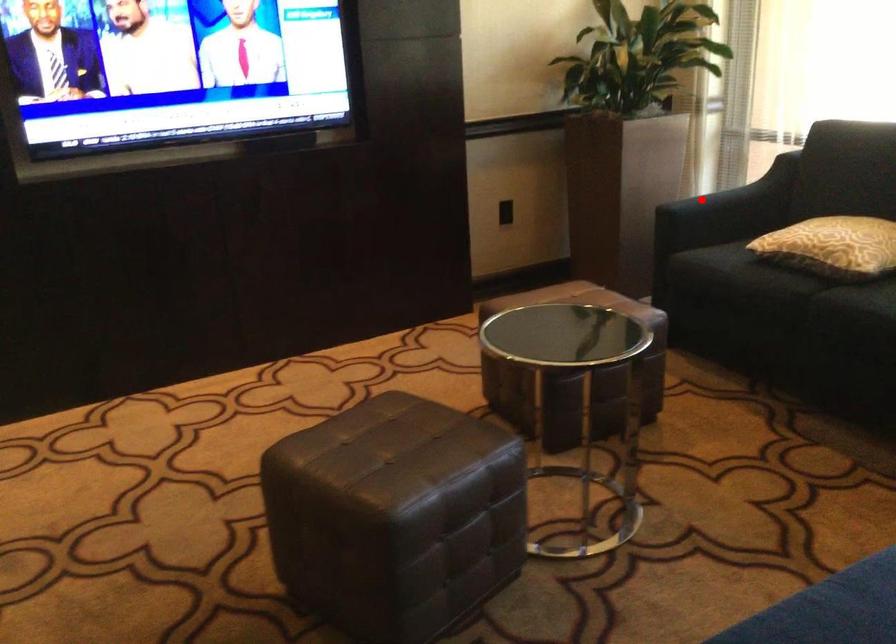
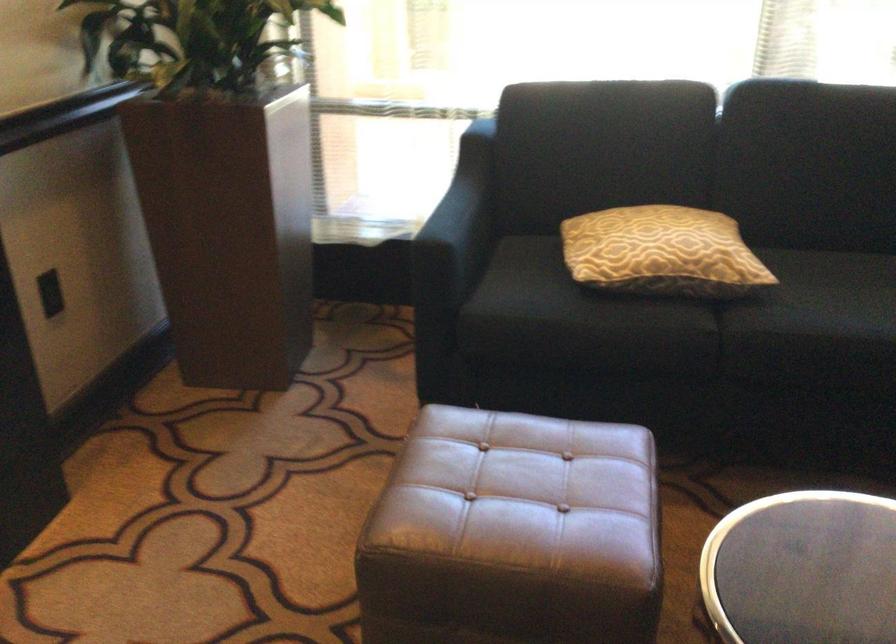
Where in the second image is the point corresponding to the highlighted location from the first image?

(458, 225)